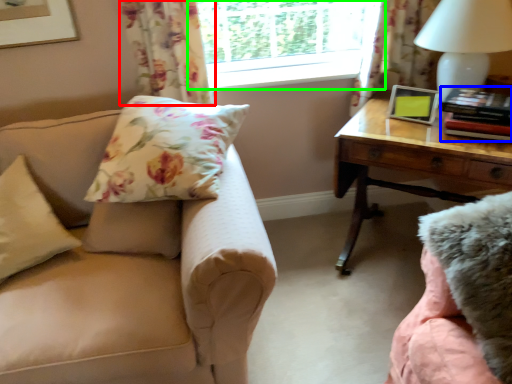
Question: Considering the real-world distances, which object is farthest from curtain (highlighted by a red box)? book (highlighted by a blue box) or window (highlighted by a green box)?

Choices:
 (A) book
 (B) window

Answer: (A)